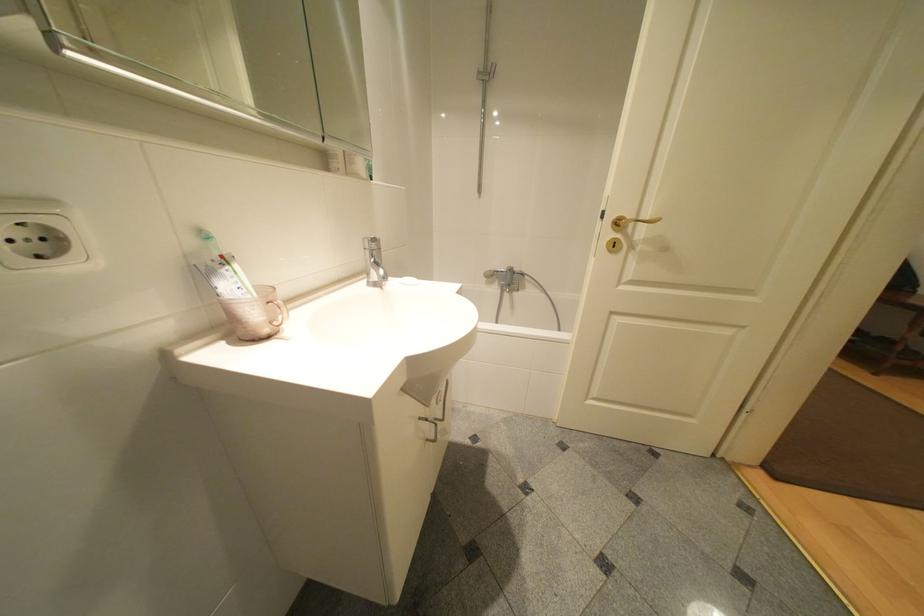
Where would you pull the shower faucet lever? Please return your answer as a coordinate pair (x, y).

(503, 277)